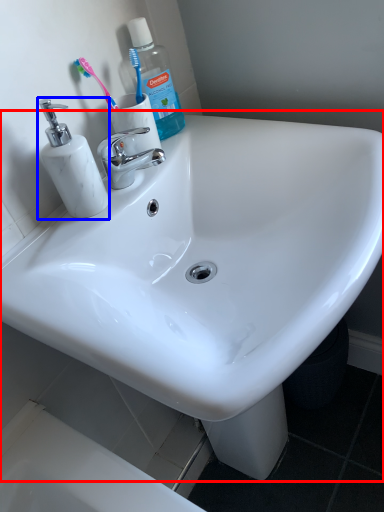
Question: Among these objects, which one is farthest to the camera, sink (highlighted by a red box) or soap dispenser (highlighted by a blue box)?

Choices:
 (A) sink
 (B) soap dispenser

Answer: (B)